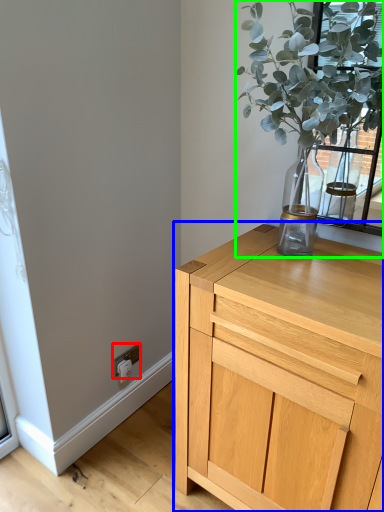
Question: Which is farther away from electric outlet (highlighted by a red box)? chest of drawers (highlighted by a blue box) or houseplant (highlighted by a green box)?

Choices:
 (A) chest of drawers
 (B) houseplant

Answer: (B)